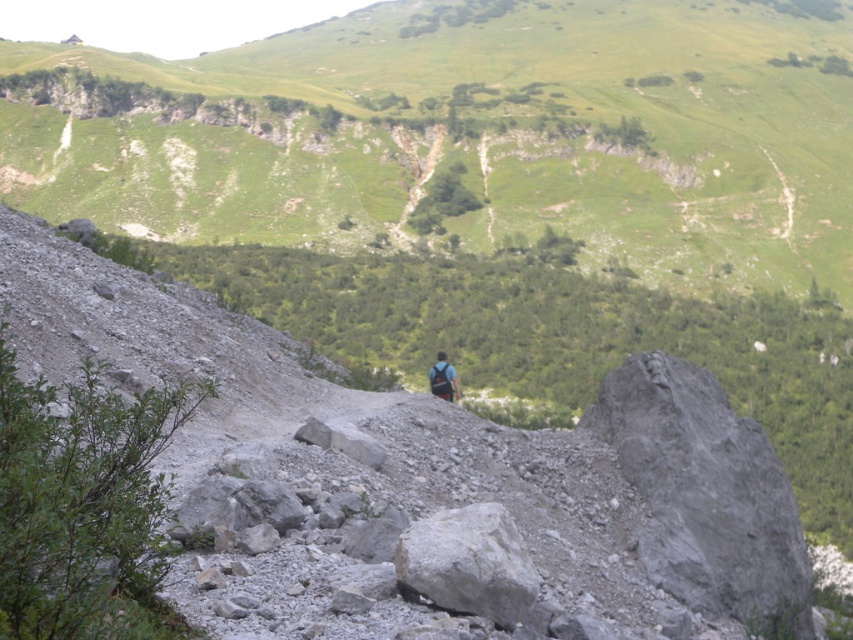
From the picture: You are a photographer standing at the edge of a valley with a camera. You notice a gray rough rock at center in the foreground. If you want to capture the rock clearly in your photo, should you adjust your camera focus to 45 feet or 50 feet?

The gray rough rock at center is 47.66 feet away from camera. Since 47.66 is closer to 50 feet than 45 feet, you should adjust the camera focus to 50 feet to capture the rock clearly.

Consider the image. You are a hiker planning to cross the rocky terrain in the foreground. There is a gray rough rock at center in your path. Can you step over it without moving your backpack?

The gray rough rock at center is located at point [468,563], which means it is positioned centrally in the scene. However, without specific information about its height or size, it is uncertain whether you can step over it without adjusting your backpack. You should assess the rock further before proceeding.

Consider the image. You are a hiker trying to reach the valley below. You see a gray rough rock at center and a dark blue backpack at center. Which object is closer to the valley?

The gray rough rock at center is closer to the valley because it is positioned below the dark blue backpack at center, meaning it is further down the slope towards the valley.